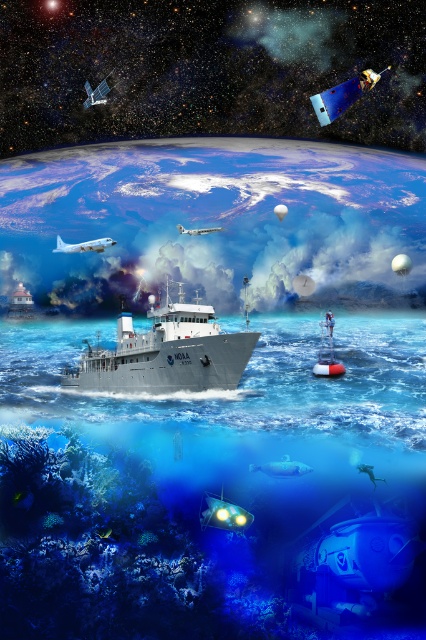
Which is more to the left, translucent blue water at center or white matte ship at center?

From the viewer's perspective, white matte ship at center appears more on the left side.

Who is more forward, (92, 572) or (89, 385)?

Positioned in front is point (92, 572).

Is point (104, 481) in front of point (147, 362)?

Yes, it is.

You are a GUI agent. You are given a task and a screenshot of the screen. Output one action in this format:
    pyautogui.click(x=<x>, y=<y>)
    Task: Click on the translucent blue water at center
    This screenshot has height=640, width=426.
    Given the screenshot: What is the action you would take?
    pyautogui.click(x=207, y=484)